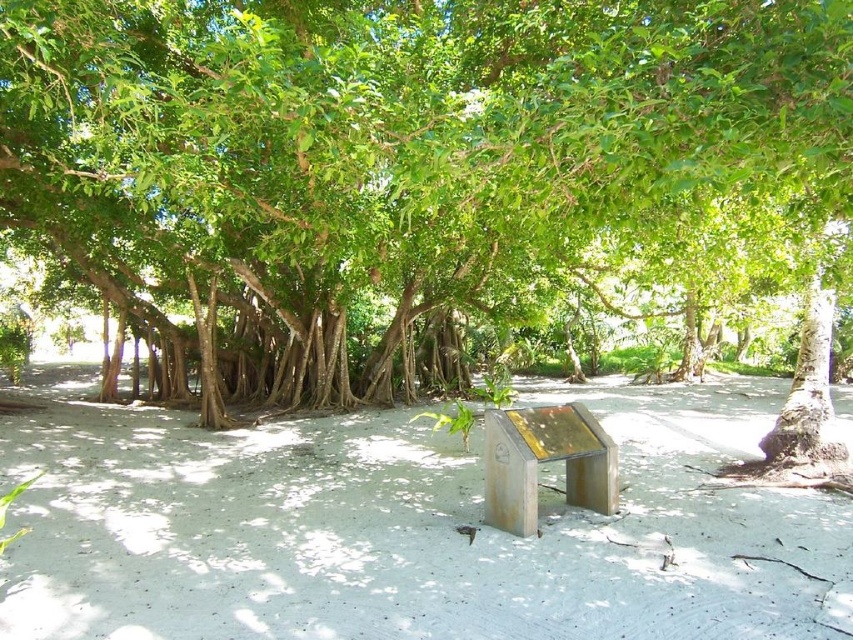
Does green leafy tree at center appear on the right side of white sandy soil at center?

In fact, green leafy tree at center is to the left of white sandy soil at center.

Does green leafy tree at center have a lesser height compared to white sandy soil at center?

No, green leafy tree at center is not shorter than white sandy soil at center.

Is point (181, 1) in front of point (408, 513)?

No, it is not.

Where is `green leafy tree at center`? Image resolution: width=853 pixels, height=640 pixels. green leafy tree at center is located at coordinates [430, 177].